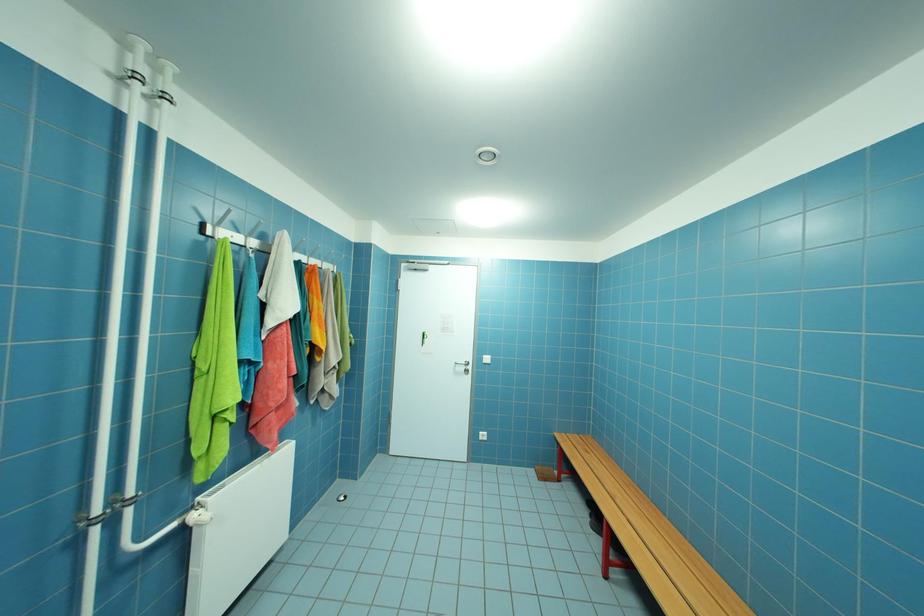
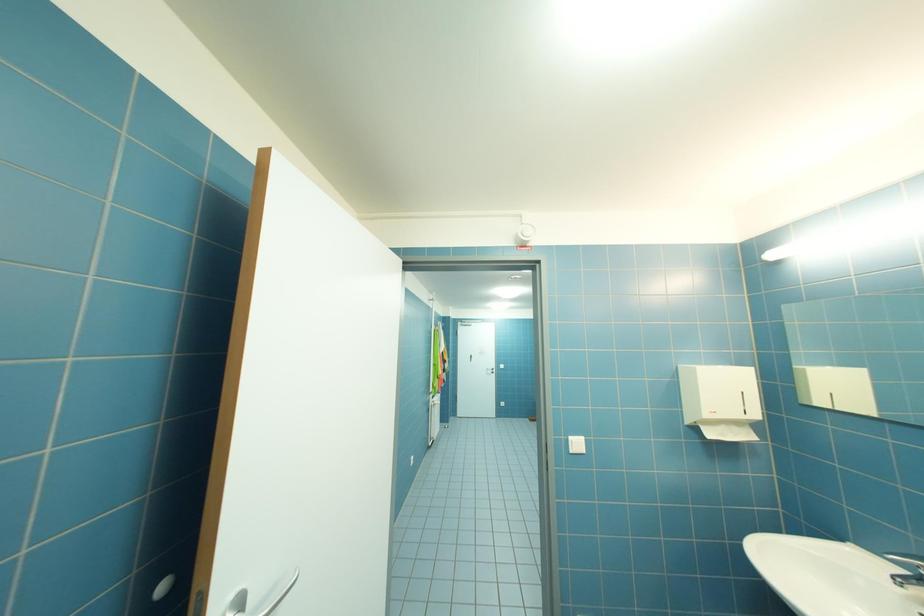
Question: The images are taken continuously from a first-person perspective. In which direction are you moving?

Choices:
 (A) Left
 (B) Right
 (C) Forward
 (D) Backward

Answer: (D)